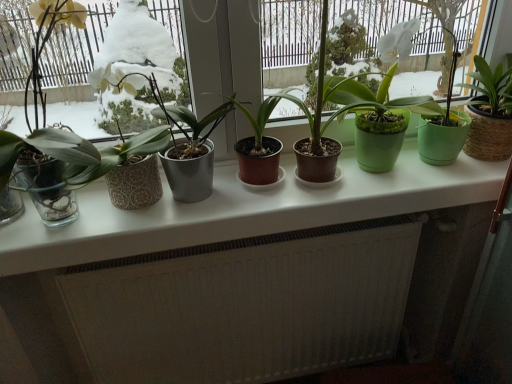
The height and width of the screenshot is (384, 512). What are the coordinates of `unoccupied area in front of metallic gray pot at center, which is the 4th houseplant in right-to-left order` in the screenshot? It's located at (201, 220).